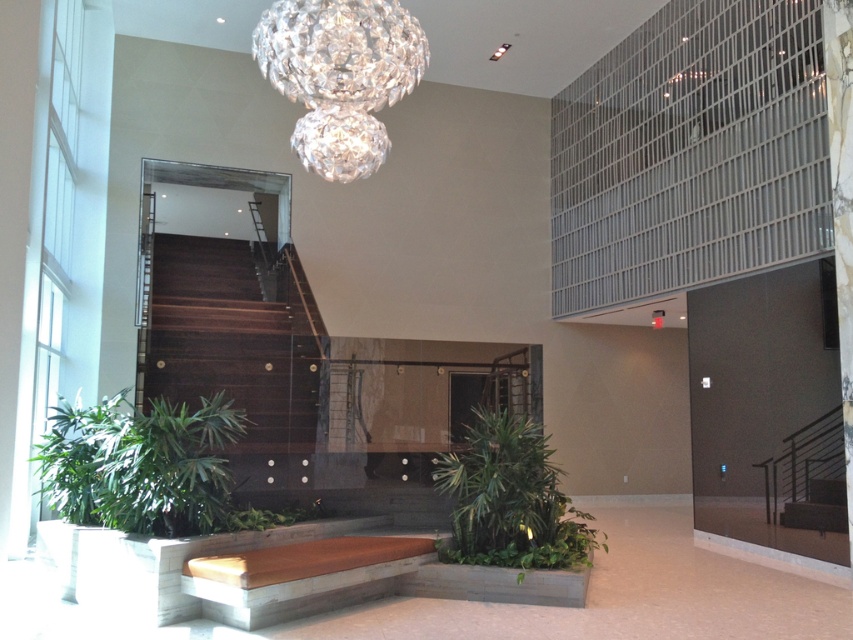
You are an interior designer planning to install a new lighting fixture in the lobby. You have a limited space budget and need to know if the crystal glass chandelier at upper center can fit in the area allocated for the green leafy plant at center. Can it fit?

The crystal glass chandelier at upper center occupies less space than the green leafy plant at center, so it can fit in the area allocated for the green leafy plant at center.

You are a decorator planning to place a new rectangular table in the lobby. The table must be placed between the green leafy plant at lower left and the crystal glass chandelier at upper center. Given their widths, which object should the table be aligned with to ensure it fits properly?

The green leafy plant at lower left is wider than the crystal glass chandelier at upper center. To ensure the table fits properly, it should be aligned with the width of the green leafy plant at lower left since it is wider.